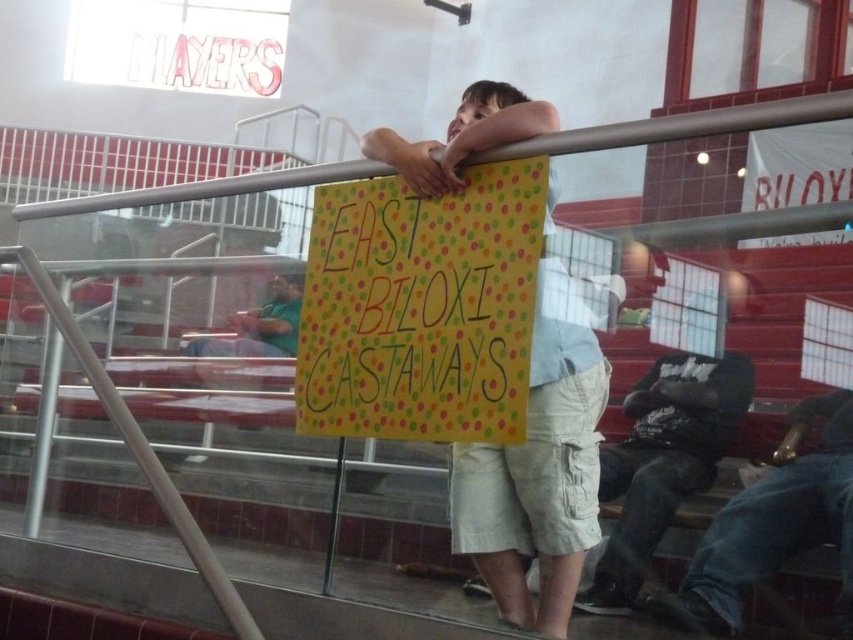
Question: Which object is the farthest from the denim pants at lower right?

Choices:
 (A) green fabric shirt at left
 (B) polka dot paper sign at center
 (C) dark gray hoodie at lower right

Answer: (A)

Question: Does polka dot paper sign at center have a greater width compared to green fabric shirt at left?

Choices:
 (A) yes
 (B) no

Answer: (A)

Question: Can you confirm if polka dot paper sign at center is positioned above green fabric shirt at left?

Choices:
 (A) no
 (B) yes

Answer: (B)

Question: Which point appears closest to the camera in this image?

Choices:
 (A) (409, 179)
 (B) (370, 180)

Answer: (A)

Question: Which is nearer to the green fabric shirt at left?

Choices:
 (A) dark gray hoodie at lower right
 (B) light beige shorts at center

Answer: (B)

Question: Can you confirm if light beige shorts at center is positioned to the left of green fabric shirt at left?

Choices:
 (A) yes
 (B) no

Answer: (B)